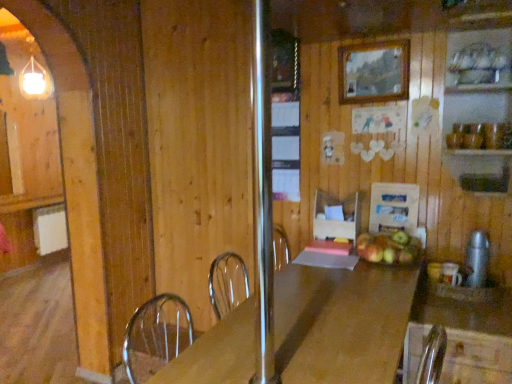
The height and width of the screenshot is (384, 512). Identify the location of free space in front of satin silver thermos at right, the first appliance from the right. (486, 301).